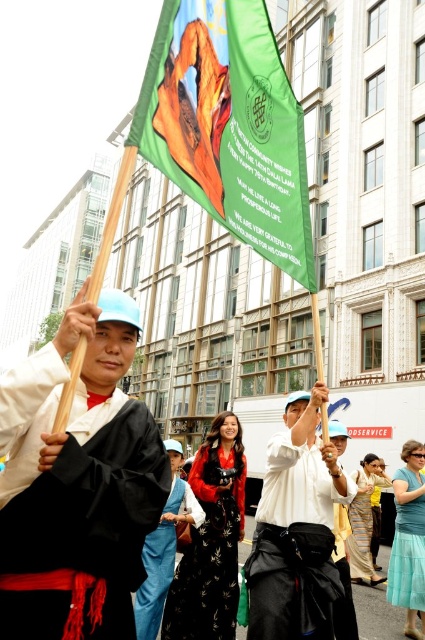
Between point (44, 612) and point (391, 582), which one is positioned behind?

The point (391, 582) is behind.

Does matte black robe at center come in front of teal satin dress at lower right?

That is True.

Locate an element on the screen. The image size is (425, 640). matte black robe at center is located at coordinates (76, 483).

You are a GUI agent. You are given a task and a screenshot of the screen. Output one action in this format:
    pyautogui.click(x=<x>, y=<y>)
    Task: Click on the matte black robe at center
    
    Given the screenshot: What is the action you would take?
    point(76,483)

What are the coordinates of `black satin dress at center` in the screenshot? It's located at (209, 554).

Locate an element on the screen. Image resolution: width=425 pixels, height=640 pixels. black satin dress at center is located at coordinates (209, 554).

At what (x,y) coordinates should I click in order to perform the action: click on teal satin dress at lower right. Please return your answer as a coordinate pair (x, y). This screenshot has height=640, width=425. Looking at the image, I should click on (407, 572).

Which is behind, point (414, 605) or point (360, 522)?

The point (360, 522) is behind.

Where is `teal satin dress at lower right`? teal satin dress at lower right is located at coordinates (407, 572).